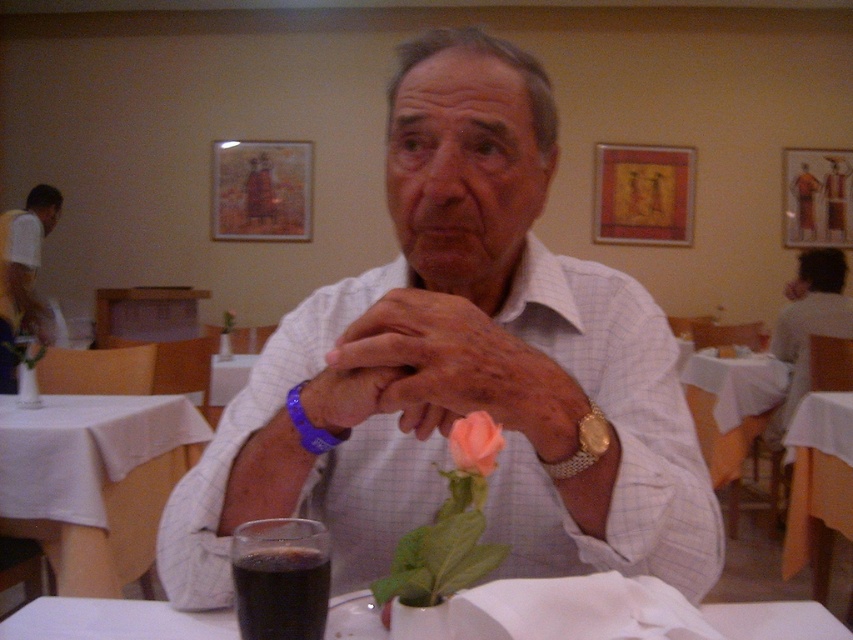
You are a delivery person who needs to place a small package between the matte white shirt at center and the pink matte rose at center. The package is 3 meters long. Will the package fit between them?

The distance between the matte white shirt at center and the pink matte rose at center is 3.51 meters. Since the package is 3 meters long, it will fit between them as there is enough space.

You are a jeweler inspecting two watches on a customer. The customer has a leather wristwatch at center and a gold mesh watch at center. Which watch is taller?

The leather wristwatch at center is taller than the gold mesh watch at center.

You are a waiter in a restaurant and need to place a new drink order for the customer seated at the table with the matte white shirt at center and the pink matte rose at center. To ensure you don not spill the drink, where should you place the drink relative to the existing items on the table?

The pink matte rose at center is behind the matte white shirt at center, so you should place the new drink to the front side of the matte white shirt at center, away from the rose to prevent spilling.